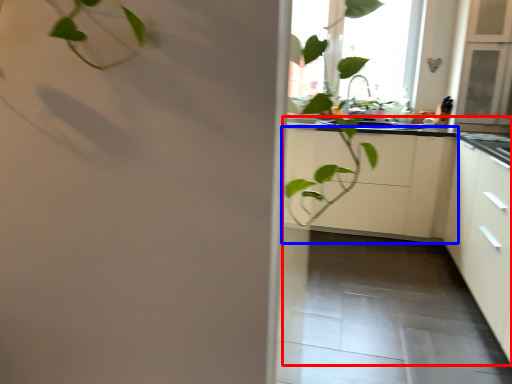
Question: Which object appears farthest to the camera in this image, counter top (highlighted by a red box) or cabinetry (highlighted by a blue box)?

Choices:
 (A) counter top
 (B) cabinetry

Answer: (B)